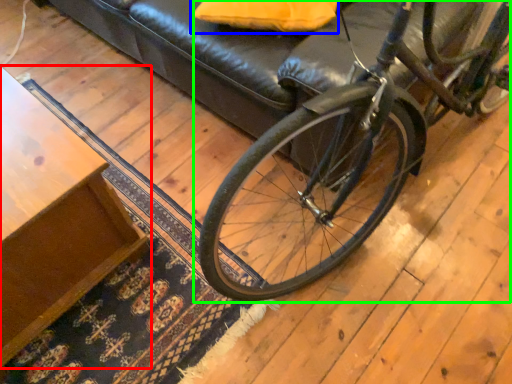
Question: Considering the real-world distances, which object is farthest from table (highlighted by a red box)? pillow (highlighted by a blue box) or bicycle (highlighted by a green box)?

Choices:
 (A) pillow
 (B) bicycle

Answer: (A)